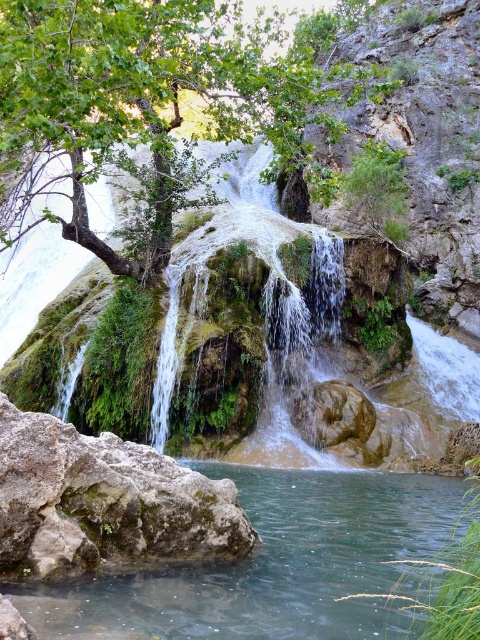
Does green leafy tree at upper center have a smaller size compared to rusty brown rock at lower left?

No.

Is green leafy tree at upper center above rusty brown rock at lower left?

Yes.

Find the location of `green leafy tree at upper center`. green leafy tree at upper center is located at coordinates (159, 106).

Measure the distance from rusty brown rock at lower left to brown rough rock at center.

A distance of 12.50 meters exists between rusty brown rock at lower left and brown rough rock at center.

Is point (68, 538) positioned before point (324, 390)?

Yes, point (68, 538) is in front of point (324, 390).

Identify the location of rusty brown rock at lower left. The width and height of the screenshot is (480, 640). (105, 502).

Who is higher up, clear water at rock left or rusty brown rock at lower left?

rusty brown rock at lower left

Which is below, clear water at rock left or rusty brown rock at lower left?

Positioned lower is clear water at rock left.

Does point (299, 500) lie in front of point (67, 451)?

No, (299, 500) is further to viewer.

Find the location of `clear water at rock left`. clear water at rock left is located at coordinates (275, 564).